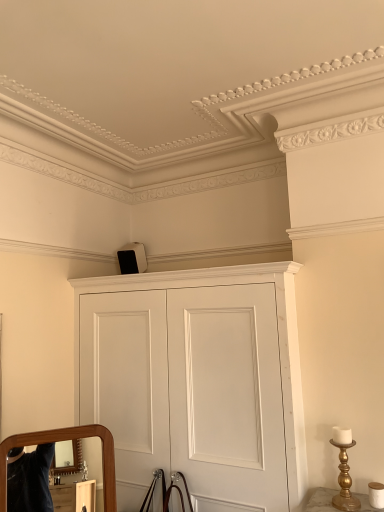
Measure the distance between gold metallic candlestick at lower right and camera.

gold metallic candlestick at lower right and camera are 5.59 feet apart from each other.

What do you see at coordinates (345, 482) in the screenshot?
I see `gold metallic candlestick at lower right` at bounding box center [345, 482].

Locate an element on the screen. This screenshot has height=512, width=384. gold metallic candlestick at lower right is located at coordinates (x=345, y=482).

In order to face gold metallic candlestick at lower right, should I rotate leftwards or rightwards?

A 19.915 degree turn to the right will do.

You are a GUI agent. You are given a task and a screenshot of the screen. Output one action in this format:
    pyautogui.click(x=<x>, y=<y>)
    Task: Click on the white matte cupboard at upper center
    
    Given the screenshot: What is the action you would take?
    pos(196,381)

Describe the element at coordinates (196, 381) in the screenshot. The height and width of the screenshot is (512, 384). I see `white matte cupboard at upper center` at that location.

I want to click on gold metallic candlestick at lower right, so point(345,482).

Which is more to the left, gold metallic candlestick at lower right or white matte cupboard at upper center?

white matte cupboard at upper center is more to the left.

From the picture: Is gold metallic candlestick at lower right behind white matte cupboard at upper center?

Yes, gold metallic candlestick at lower right is further from the viewer.

Between point (346, 483) and point (137, 297), which one is positioned in front?

Point (346, 483)

From the image's perspective, is gold metallic candlestick at lower right over white matte cupboard at upper center?

No, from the image's perspective, gold metallic candlestick at lower right is not above white matte cupboard at upper center.

From a real-world perspective, is gold metallic candlestick at lower right over white matte cupboard at upper center?

No, from a real-world perspective, gold metallic candlestick at lower right is not above white matte cupboard at upper center.

Can you confirm if gold metallic candlestick at lower right is wider than white matte cupboard at upper center?

In fact, gold metallic candlestick at lower right might be narrower than white matte cupboard at upper center.

Can you confirm if gold metallic candlestick at lower right is taller than white matte cupboard at upper center?

No.

Who is bigger, gold metallic candlestick at lower right or white matte cupboard at upper center?

With larger size is white matte cupboard at upper center.

Is white matte cupboard at upper center located within gold metallic candlestick at lower right?

No, white matte cupboard at upper center is not surrounded by gold metallic candlestick at lower right.

In the scene shown: Is gold metallic candlestick at lower right far from white matte cupboard at upper center?

That's not correct — gold metallic candlestick at lower right is a little close to white matte cupboard at upper center.

Looking at this image, is gold metallic candlestick at lower right facing away from white matte cupboard at upper center?

No, white matte cupboard at upper center is not at the back of gold metallic candlestick at lower right.

Measure the distance from gold metallic candlestick at lower right to white matte cupboard at upper center.

gold metallic candlestick at lower right is 73.74 centimeters away from white matte cupboard at upper center.

Where is `table lamp that appears behind the white matte cupboard at upper center`? table lamp that appears behind the white matte cupboard at upper center is located at coordinates (345, 482).

Based on their positions, is white matte cupboard at upper center located to the left or right of gold metallic candlestick at lower right?

white matte cupboard at upper center is positioned on gold metallic candlestick at lower right's left side.

Does white matte cupboard at upper center lie in front of gold metallic candlestick at lower right?

Yes, white matte cupboard at upper center is closer to the viewer.

Which point is more distant from viewer, [257,341] or [355,510]?

The point [257,341] is behind.

Based on the photo, from the image's perspective, is white matte cupboard at upper center beneath gold metallic candlestick at lower right?

No, from the image's perspective, white matte cupboard at upper center is not beneath gold metallic candlestick at lower right.

From a real-world perspective, does white matte cupboard at upper center stand above gold metallic candlestick at lower right?

Yes, from a real-world perspective, white matte cupboard at upper center is above gold metallic candlestick at lower right.

Considering the sizes of objects white matte cupboard at upper center and gold metallic candlestick at lower right in the image provided, who is thinner, white matte cupboard at upper center or gold metallic candlestick at lower right?

gold metallic candlestick at lower right.

Which of these two, white matte cupboard at upper center or gold metallic candlestick at lower right, stands shorter?

gold metallic candlestick at lower right is shorter.

Between white matte cupboard at upper center and gold metallic candlestick at lower right, which one has smaller size?

Smaller between the two is gold metallic candlestick at lower right.

Is gold metallic candlestick at lower right surrounded by white matte cupboard at upper center?

Definitely not — gold metallic candlestick at lower right is not inside white matte cupboard at upper center.

Is white matte cupboard at upper center positioned far away from gold metallic candlestick at lower right?

white matte cupboard at upper center is actually quite close to gold metallic candlestick at lower right.

Is white matte cupboard at upper center looking in the opposite direction of gold metallic candlestick at lower right?

white matte cupboard at upper center does not have its back to gold metallic candlestick at lower right.

Measure the distance between white matte cupboard at upper center and gold metallic candlestick at lower right.

A distance of 29.03 inches exists between white matte cupboard at upper center and gold metallic candlestick at lower right.

The height and width of the screenshot is (512, 384). I want to click on cupboard in front of the gold metallic candlestick at lower right, so click(x=196, y=381).

Locate an element on the screen. This screenshot has height=512, width=384. cupboard to the left of gold metallic candlestick at lower right is located at coordinates (196, 381).

This screenshot has width=384, height=512. Identify the location of table lamp that appears below the white matte cupboard at upper center (from the image's perspective). (345, 482).